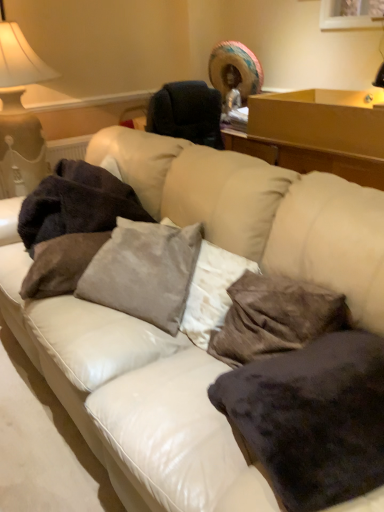
What do you see at coordinates (321, 120) in the screenshot? I see `wooden table at upper right` at bounding box center [321, 120].

Measure the distance between point (22, 218) and camera.

Point (22, 218) is 2.05 meters from camera.

This screenshot has width=384, height=512. Describe the element at coordinates (61, 264) in the screenshot. I see `suede-like gray pillow at center, the 1th pillow when ordered from left to right` at that location.

Measure the distance between velvety dark brown pillow at lower right, marked as the 1th pillow in a right-to-left arrangement, and camera.

The depth of velvety dark brown pillow at lower right, marked as the 1th pillow in a right-to-left arrangement, is 28.82 inches.

In order to face velvet gray pillow at center, which is the third pillow from right to left, should I rotate leftwards or rightwards?

You should rotate left by 6.737 degrees.

Locate an element on the screen. wooden table at upper right is located at coordinates (321, 120).

You are a GUI agent. You are given a task and a screenshot of the screen. Output one action in this format:
    pyautogui.click(x=<x>, y=<y>)
    Task: Click on the blanket above the velvet gray pillow at center, which is the third pillow from right to left (from a real-world perspective)
    Image resolution: width=384 pixels, height=512 pixels.
    Given the screenshot: What is the action you would take?
    76,204

In the scene shown: Does velvet gray pillow at center, positioned as the 2th pillow in left-to-right order, have a greater width compared to dark brown plush blanket at left?

Incorrect, the width of velvet gray pillow at center, positioned as the 2th pillow in left-to-right order, does not surpass that of dark brown plush blanket at left.

Can you confirm if velvet gray pillow at center, positioned as the 2th pillow in left-to-right order, is positioned to the right of dark brown plush blanket at left?

Indeed, velvet gray pillow at center, positioned as the 2th pillow in left-to-right order, is positioned on the right side of dark brown plush blanket at left.

Considering the positions of objects wooden table at upper right and velvety dark brown pillow at lower right, which is the fourth pillow in left-to-right order, in the image provided, who is behind, wooden table at upper right or velvety dark brown pillow at lower right, which is the fourth pillow in left-to-right order,?

wooden table at upper right is further away from the camera.

Does point (347, 122) appear closer or farther from the camera than point (252, 438)?

Point (347, 122) appears to be farther away from the viewer than point (252, 438).

Is wooden table at upper right at the left side of velvety dark brown pillow at lower right, marked as the 1th pillow in a right-to-left arrangement?

Incorrect, wooden table at upper right is not on the left side of velvety dark brown pillow at lower right, marked as the 1th pillow in a right-to-left arrangement.

Is wooden table at upper right closer to the viewer compared to dark brown plush blanket at left?

No, the depth of wooden table at upper right is greater than that of dark brown plush blanket at left.

From the image's perspective, is wooden table at upper right located above or below dark brown plush blanket at left?

Based on their image positions, wooden table at upper right is located above dark brown plush blanket at left.

Which of these two, wooden table at upper right or dark brown plush blanket at left, stands taller?

dark brown plush blanket at left.

Which is more to the left, wooden table at upper right or dark brown plush blanket at left?

From the viewer's perspective, dark brown plush blanket at left appears more on the left side.

Considering the relative sizes of velvety dark brown pillow at lower right, marked as the 1th pillow in a right-to-left arrangement, and matte white lampshade at upper left in the image provided, is velvety dark brown pillow at lower right, marked as the 1th pillow in a right-to-left arrangement, taller than matte white lampshade at upper left?

No.

Can you see velvety dark brown pillow at lower right, marked as the 1th pillow in a right-to-left arrangement, touching matte white lampshade at upper left?

velvety dark brown pillow at lower right, marked as the 1th pillow in a right-to-left arrangement, and matte white lampshade at upper left are not in contact.

In the scene shown: Does velvety dark brown pillow at lower right, marked as the 1th pillow in a right-to-left arrangement, have a larger size compared to matte white lampshade at upper left?

Actually, velvety dark brown pillow at lower right, marked as the 1th pillow in a right-to-left arrangement, might be smaller than matte white lampshade at upper left.

Between velvety dark brown pillow at lower right, which is the fourth pillow in left-to-right order, and matte white lampshade at upper left, which one is positioned behind?

matte white lampshade at upper left.

Considering the sizes of objects matte white lampshade at upper left and dark brown plush blanket at left in the image provided, who is taller, matte white lampshade at upper left or dark brown plush blanket at left?

matte white lampshade at upper left.

Is matte white lampshade at upper left turned away from dark brown plush blanket at left?

matte white lampshade at upper left is not turned away from dark brown plush blanket at left.

From the image's perspective, which is below, matte white lampshade at upper left or dark brown plush blanket at left?

dark brown plush blanket at left is shown below in the image.

How much distance is there between matte white lampshade at upper left and dark brown plush blanket at left?

A distance of 26.08 inches exists between matte white lampshade at upper left and dark brown plush blanket at left.

Which of these two, wooden table at upper right or suede-like gray pillow at center, the 1th pillow when ordered from left to right, stands shorter?

Standing shorter between the two is suede-like gray pillow at center, the 1th pillow when ordered from left to right.

Which of these two, wooden table at upper right or suede-like gray pillow at center, the 1th pillow when ordered from left to right, is thinner?

Answer: suede-like gray pillow at center, the 1th pillow when ordered from left to right.

Do you think wooden table at upper right is within suede-like gray pillow at center, the 1th pillow when ordered from left to right, or outside of it?

The correct answer is: outside.

Are matte white lampshade at upper left and suede-like gray pillow at center, the 1th pillow when ordered from left to right, located far from each other?

matte white lampshade at upper left is far away from suede-like gray pillow at center, the 1th pillow when ordered from left to right.

From a real-world perspective, between matte white lampshade at upper left and suede-like gray pillow at center, arranged as the 4th pillow when viewed from the right, who is vertically higher?

In real-world perspective, matte white lampshade at upper left is above.

From the image's perspective, is matte white lampshade at upper left beneath suede-like gray pillow at center, arranged as the 4th pillow when viewed from the right?

No, from the image's perspective, matte white lampshade at upper left is not below suede-like gray pillow at center, arranged as the 4th pillow when viewed from the right.

Where is `blanket above the velvet gray pillow at center, positioned as the 2th pillow in left-to-right order (from the image's perspective)`? blanket above the velvet gray pillow at center, positioned as the 2th pillow in left-to-right order (from the image's perspective) is located at coordinates (76, 204).

Image resolution: width=384 pixels, height=512 pixels. What are the coordinates of `the 1st pillow counting from the left of the wooden table at upper right` in the screenshot? It's located at (313, 417).

Based on their spatial positions, is suede-like gray pillow at center, arranged as the 4th pillow when viewed from the right, or matte white lampshade at upper left closer to wooden table at upper right?

suede-like gray pillow at center, arranged as the 4th pillow when viewed from the right.

Estimate the real-world distances between objects in this image. Which object is further from suede-like gray pillow at center, the 1th pillow when ordered from left to right, wooden table at upper right or velvety dark brown pillow at lower right, which is the fourth pillow in left-to-right order?

The object further to suede-like gray pillow at center, the 1th pillow when ordered from left to right, is wooden table at upper right.

Looking at the image, which one is located further to velvet gray pillow at center, positioned as the 2th pillow in left-to-right order, dark brown plush blanket at left or velvety dark brown pillow at center, the 3th pillow from the left?

Based on the image, dark brown plush blanket at left appears to be further to velvet gray pillow at center, positioned as the 2th pillow in left-to-right order.

Estimate the real-world distances between objects in this image. Which object is closer to velvet gray pillow at center, which is the third pillow from right to left, matte white lampshade at upper left or suede-like gray pillow at center, the 1th pillow when ordered from left to right?

suede-like gray pillow at center, the 1th pillow when ordered from left to right, is closer to velvet gray pillow at center, which is the third pillow from right to left.

From the image, which object appears to be farther from velvet gray pillow at center, which is the third pillow from right to left, matte white lampshade at upper left or velvety dark brown pillow at center, the 3th pillow from the left?

Based on the image, matte white lampshade at upper left appears to be further to velvet gray pillow at center, which is the third pillow from right to left.

From the image, which object appears to be farther from wooden table at upper right, velvety dark brown pillow at lower right, which is the fourth pillow in left-to-right order, or suede-like gray pillow at center, arranged as the 4th pillow when viewed from the right?

Based on the image, velvety dark brown pillow at lower right, which is the fourth pillow in left-to-right order, appears to be further to wooden table at upper right.

Based on their spatial positions, is dark brown plush blanket at left or suede-like gray pillow at center, arranged as the 4th pillow when viewed from the right, closer to velvety dark brown pillow at lower right, which is the fourth pillow in left-to-right order?

Based on the image, suede-like gray pillow at center, arranged as the 4th pillow when viewed from the right, appears to be nearer to velvety dark brown pillow at lower right, which is the fourth pillow in left-to-right order.

Considering their positions, is wooden table at upper right positioned closer to velvet gray pillow at center, positioned as the 2th pillow in left-to-right order, than matte white lampshade at upper left?

The object closer to velvet gray pillow at center, positioned as the 2th pillow in left-to-right order, is wooden table at upper right.

Identify the location of blanket between matte white lampshade at upper left and velvet gray pillow at center, positioned as the 2th pillow in left-to-right order. (76, 204).

The height and width of the screenshot is (512, 384). I want to click on blanket between matte white lampshade at upper left and suede-like gray pillow at center, arranged as the 4th pillow when viewed from the right, from top to bottom, so click(76, 204).

At what (x,y) coordinates should I click in order to perform the action: click on pillow between velvety dark brown pillow at lower right, which is the fourth pillow in left-to-right order, and velvet gray pillow at center, which is the third pillow from right to left, from front to back. Please return your answer as a coordinate pair (x, y). Looking at the image, I should click on (275, 318).

Where is `blanket situated between matte white lampshade at upper left and velvety dark brown pillow at center, which ranks as the 2th pillow in right-to-left order, from left to right`? This screenshot has height=512, width=384. blanket situated between matte white lampshade at upper left and velvety dark brown pillow at center, which ranks as the 2th pillow in right-to-left order, from left to right is located at coordinates (76, 204).